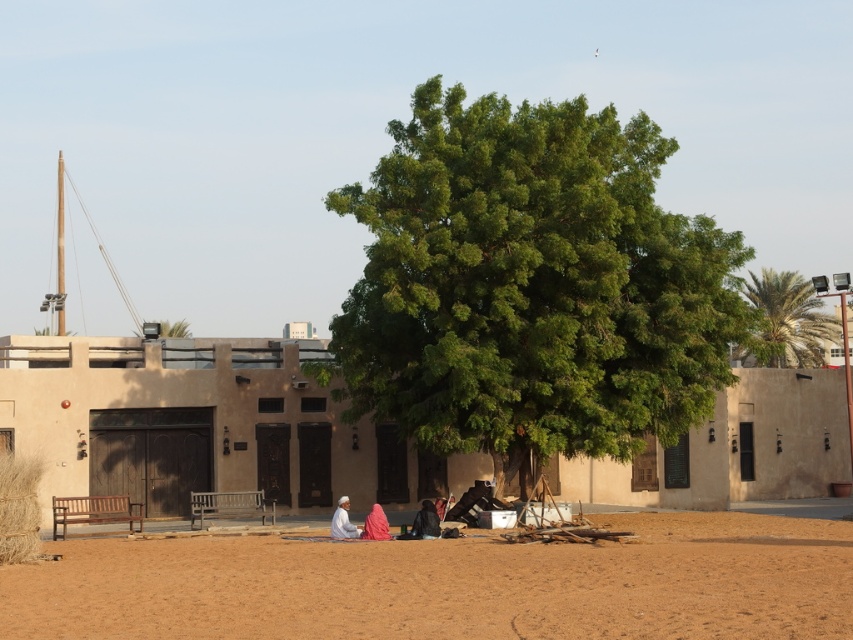
You are planning to set up a tent for a desert camping trip. You have two options for the location based on the image provided. The first option is on the brown sandy dirt field at lower center, and the second is on the white fabric at center. Considering the height difference between these two locations, which location would be more stable for the tent foundation?

The brown sandy dirt field at lower center has a greater height compared to the white fabric at center, so setting up the tent on the brown sandy dirt field at lower center would provide a more stable foundation due to its higher elevation, which might offer better drainage and structural support.

You are a traveler in the desert and see the green leafy tree at upper right and the dark brown leather jacket at lower center. Which object is located to the right of the other?

The green leafy tree at upper right is positioned on the right side of dark brown leather jacket at lower center.

You are standing at the origin point in the image. Where is the brown sandy dirt field at lower center located in terms of its 2D coordinates?

The brown sandy dirt field at lower center is located at the 2D coordinates of point (450, 584).